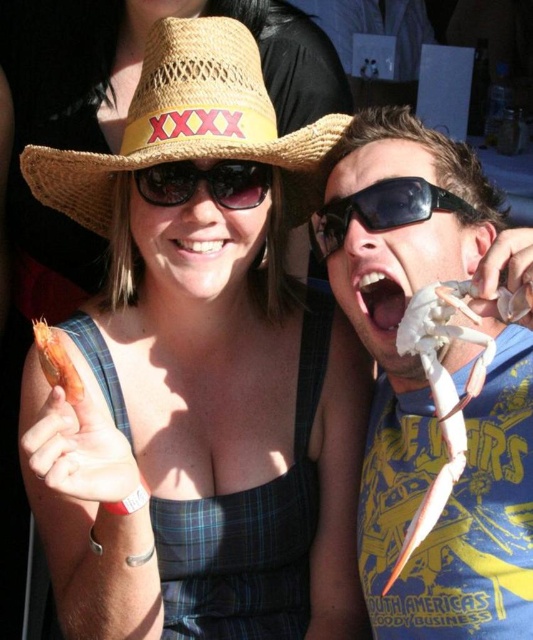
Does white matte teeth at center have a greater height compared to white glossy teeth at center?

Indeed, white matte teeth at center has a greater height compared to white glossy teeth at center.

Identify the location of white matte teeth at center. (379, 298).

What are the coordinates of `white matte teeth at center` in the screenshot? It's located at (379, 298).

Between white matte crab claw at center and black reflective sunglasses at upper center, which one appears on the right side from the viewer's perspective?

white matte crab claw at center

Where is `white matte crab claw at center`? white matte crab claw at center is located at coordinates (427, 385).

Between point (364, 538) and point (263, 193), which one is positioned behind?

Point (364, 538)

You are a GUI agent. You are given a task and a screenshot of the screen. Output one action in this format:
    pyautogui.click(x=<x>, y=<y>)
    Task: Click on the white matte crab claw at center
    Image resolution: width=533 pixels, height=640 pixels.
    Given the screenshot: What is the action you would take?
    pyautogui.click(x=427, y=385)

Does straw hat at upper center have a larger size compared to white glossy teeth at center?

Indeed, straw hat at upper center has a larger size compared to white glossy teeth at center.

Locate an element on the screen. Image resolution: width=533 pixels, height=640 pixels. straw hat at upper center is located at coordinates (189, 124).

This screenshot has width=533, height=640. Describe the element at coordinates (189, 124) in the screenshot. I see `straw hat at upper center` at that location.

You are a GUI agent. You are given a task and a screenshot of the screen. Output one action in this format:
    pyautogui.click(x=<x>, y=<y>)
    Task: Click on the straw hat at upper center
    This screenshot has height=640, width=533.
    Given the screenshot: What is the action you would take?
    pyautogui.click(x=189, y=124)